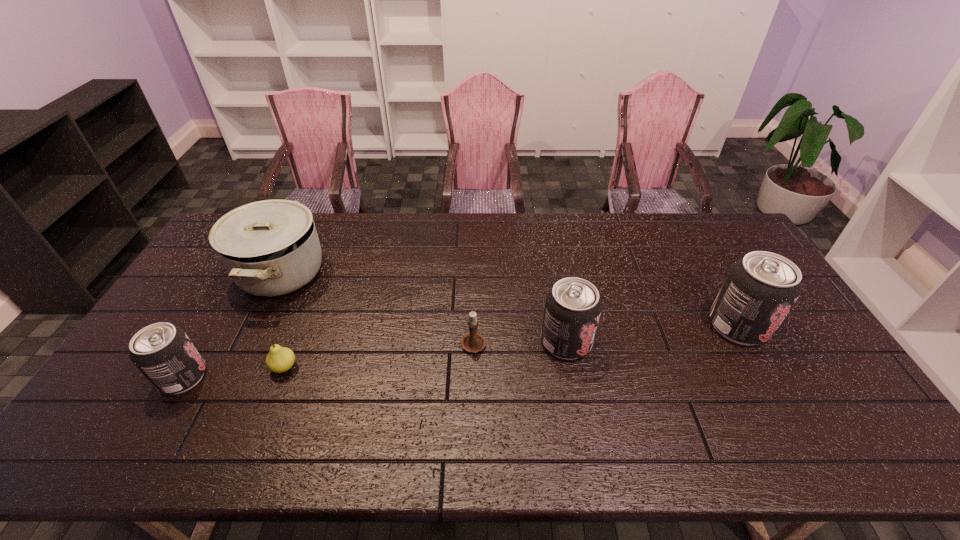
Identify which object is located as the fifth nearest to the pear. Please provide its 2D coordinates. Your answer should be formatted as a tuple, i.e. [(x, y)], where the tuple contains the x and y coordinates of a point satisfying the conditions above.

[(760, 289)]

Point out which soda can is positioned as the nearest to the saucepan. Please provide its 2D coordinates. Your answer should be formatted as a tuple, i.e. [(x, y)], where the tuple contains the x and y coordinates of a point satisfying the conditions above.

[(163, 353)]

Locate which soda can ranks third in proximity to the saucepan. Please provide its 2D coordinates. Your answer should be formatted as a tuple, i.e. [(x, y)], where the tuple contains the x and y coordinates of a point satisfying the conditions above.

[(760, 289)]

The width and height of the screenshot is (960, 540). What are the coordinates of `vacant space that satisfies the following two spatial constraints: 1. on the side of the rightmost object with the handle; 2. on the left side of the third object from right to left` in the screenshot? It's located at [473, 326].

You are a GUI agent. You are given a task and a screenshot of the screen. Output one action in this format:
    pyautogui.click(x=<x>, y=<y>)
    Task: Click on the vacant region that satisfies the following two spatial constraints: 1. on the side of the second soda can from left to right with the handle; 2. on the left side of the third object from right to left
    This screenshot has height=540, width=960.
    Given the screenshot: What is the action you would take?
    pyautogui.click(x=473, y=342)